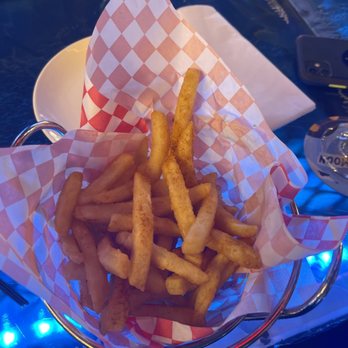
This screenshot has height=348, width=348. Identify the location of napkin. pyautogui.click(x=271, y=81).